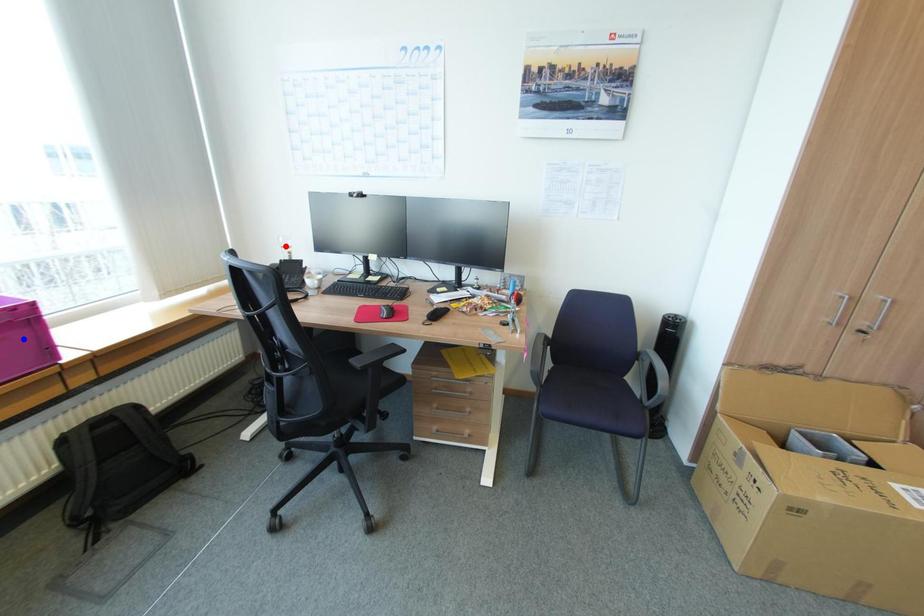
Question: In the image, two points are highlighted. Which point is nearer to the camera? Reply with the corresponding letter.

Choices:
 (A) blue point
 (B) red point

Answer: (A)